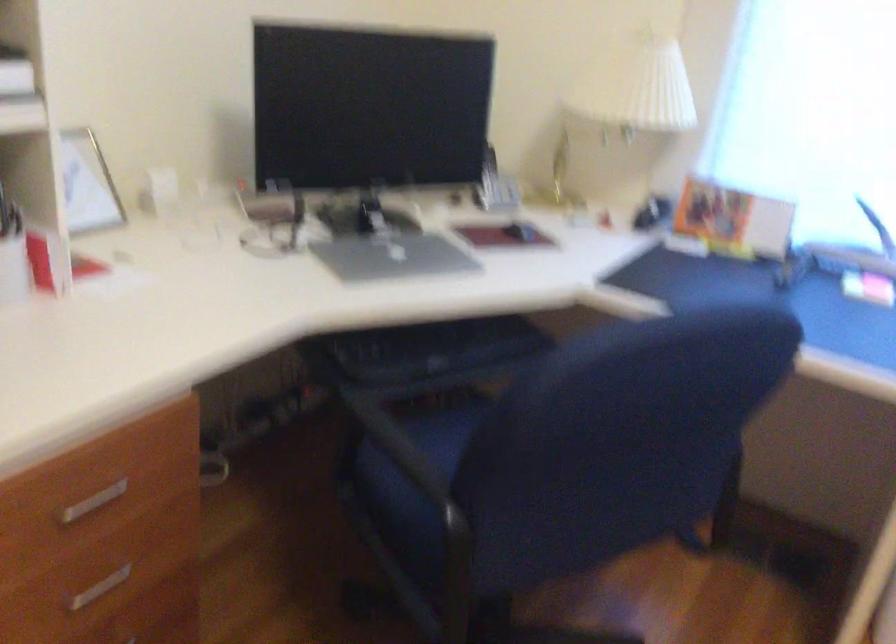
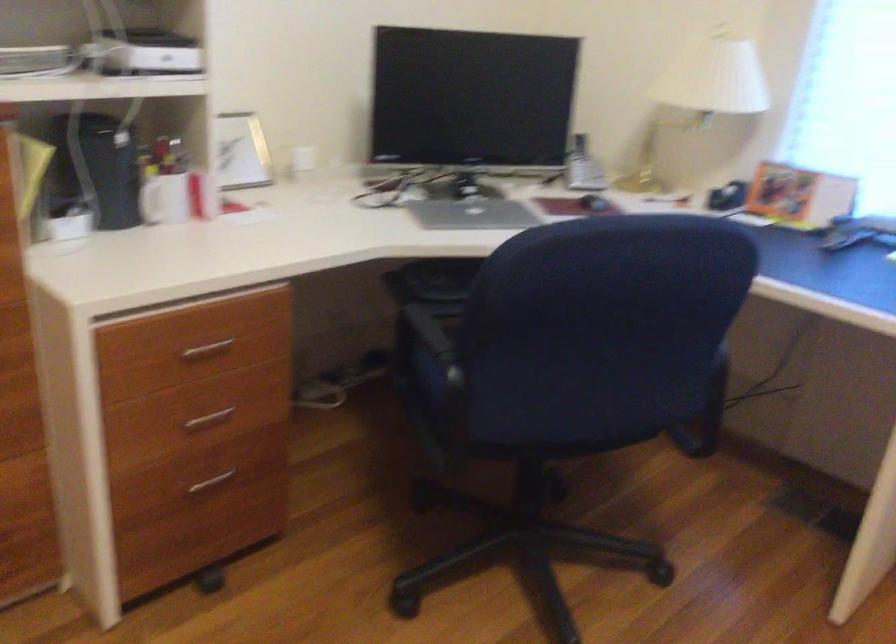
Question: The images are taken continuously from a first-person perspective. In which direction is your viewpoint rotating?

Choices:
 (A) Left
 (B) Right
 (C) Up
 (D) Down

Answer: (A)